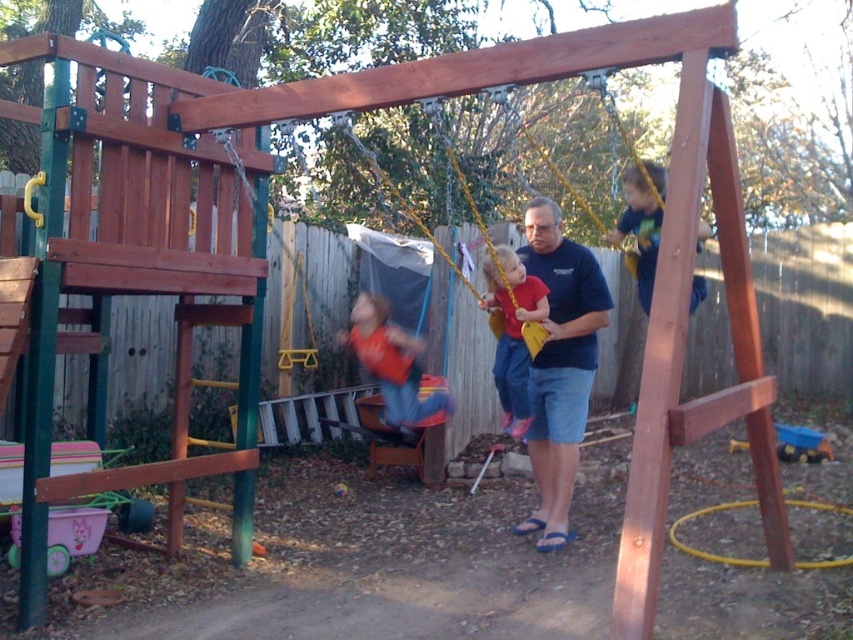
Question: Is dark blue t-shirt at center bigger than yellow fabric swing at center?

Choices:
 (A) yes
 (B) no

Answer: (B)

Question: Which point is farther to the camera?

Choices:
 (A) (433, 404)
 (B) (497, 301)

Answer: (A)

Question: Observing the image, what is the correct spatial positioning of dark blue t-shirt at upper right in reference to yellow fabric swing at center?

Choices:
 (A) right
 (B) left

Answer: (A)

Question: Which object appears closest to the camera in this image?

Choices:
 (A) yellow fabric swing at center
 (B) matte yellow swing at center
 (C) matte red swing at center

Answer: (A)

Question: Which point appears farthest from the camera in this image?

Choices:
 (A) (492, 378)
 (B) (554, 243)
 (C) (508, 289)

Answer: (A)

Question: In this image, where is matte red swing at center located relative to dark blue t-shirt at upper right?

Choices:
 (A) right
 (B) left

Answer: (B)